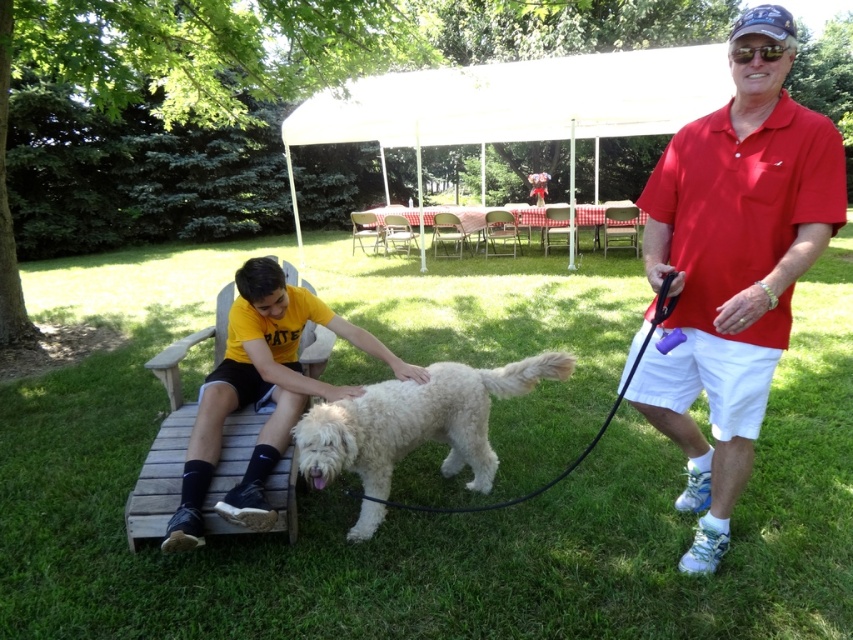
You are standing in the scene and notice the red cotton shirt at right and the black rubber leash at center. From your perspective, which object is higher?

The red cotton shirt at right is above the black rubber leash at center, so the red cotton shirt at right is higher.

You are standing at the picnic area and want to place a small decoration between the two points labeled point (704, 520) and point (486, 449). Which point is closer to you where you should start placing the decoration?

Point (704, 520) is closer to the viewer than point (486, 449), so you should start placing the decoration closer to point (704, 520).